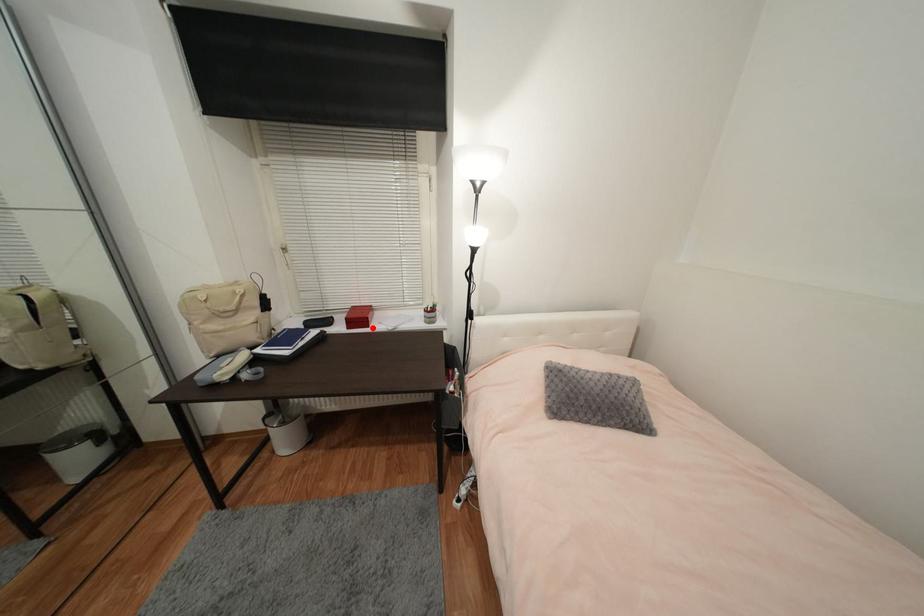
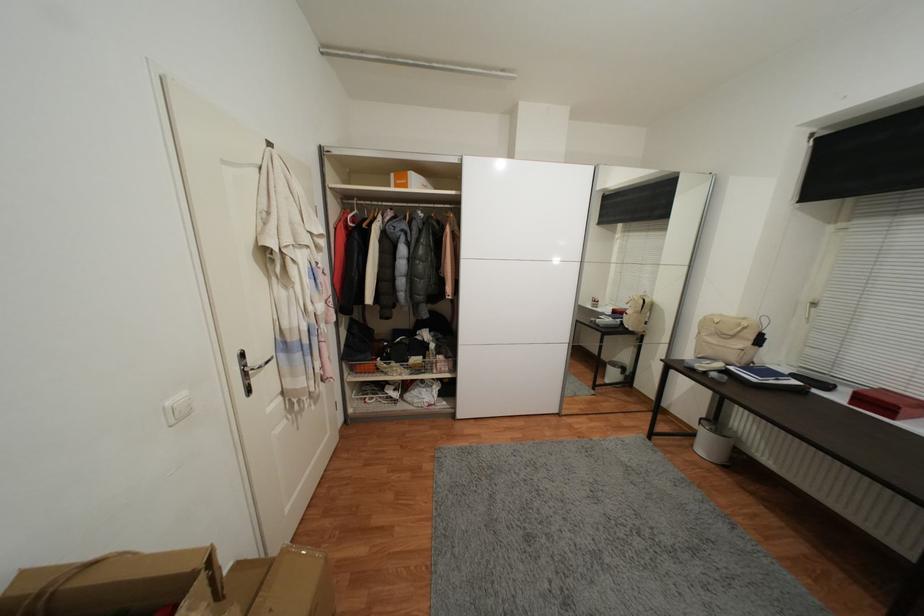
Where in the second image is the point corresponding to the highlighted location from the first image?

(897, 419)